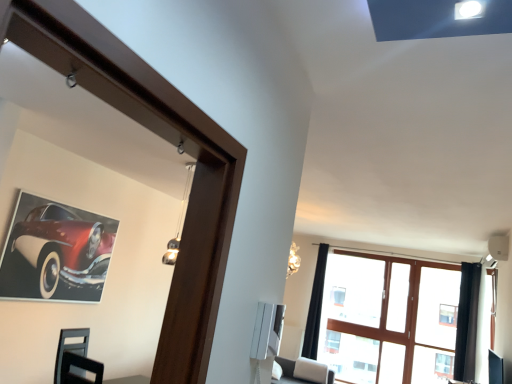
Question: From a real-world perspective, is black fabric curtain at upper right, the 2th curtain from the front, on black velvet curtain at right, which ranks as the 2th curtain in left-to-right order?

Choices:
 (A) no
 (B) yes

Answer: (A)

Question: Would you say black fabric curtain at upper right, marked as the second curtain in a right-to-left arrangement, is a long distance from black velvet curtain at right, which appears as the 1th curtain when viewed from the right?

Choices:
 (A) yes
 (B) no

Answer: (A)

Question: Does black fabric curtain at upper right, the 2th curtain from the front, have a smaller size compared to black velvet curtain at right, which is the first curtain from front to back?

Choices:
 (A) no
 (B) yes

Answer: (A)

Question: Does black fabric curtain at upper right, which ranks as the first curtain in left-to-right order, have a lesser width compared to black velvet curtain at right, which appears as the 1th curtain when viewed from the right?

Choices:
 (A) yes
 (B) no

Answer: (A)

Question: From the image's perspective, does black fabric curtain at upper right, which ranks as the first curtain in left-to-right order, appear higher than black velvet curtain at right, which is the first curtain from front to back?

Choices:
 (A) yes
 (B) no

Answer: (B)

Question: Is point (318, 312) closer or farther from the camera than point (467, 352)?

Choices:
 (A) closer
 (B) farther

Answer: (B)

Question: From the image's perspective, is black fabric curtain at upper right, marked as the 1th curtain in a back-to-front arrangement, above or below black velvet curtain at right, which appears as the 2th curtain when viewed from the back?

Choices:
 (A) above
 (B) below

Answer: (B)

Question: From a real-world perspective, relative to black velvet curtain at right, which is the first curtain from front to back, is black fabric curtain at upper right, which ranks as the first curtain in left-to-right order, vertically above or below?

Choices:
 (A) below
 (B) above

Answer: (A)

Question: Do you think black fabric curtain at upper right, marked as the second curtain in a right-to-left arrangement, is within black velvet curtain at right, which appears as the 1th curtain when viewed from the right, or outside of it?

Choices:
 (A) outside
 (B) inside

Answer: (A)

Question: From the image's perspective, is shiny red car at upper left positioned above or below black velvet curtain at right, which is the first curtain from front to back?

Choices:
 (A) above
 (B) below

Answer: (A)

Question: Based on their positions, is shiny red car at upper left located to the left or right of black velvet curtain at right, which is the first curtain from front to back?

Choices:
 (A) left
 (B) right

Answer: (A)

Question: From a real-world perspective, is shiny red car at upper left physically located above or below black velvet curtain at right, which appears as the 2th curtain when viewed from the back?

Choices:
 (A) below
 (B) above

Answer: (A)

Question: Is point (25, 263) positioned closer to the camera than point (464, 360)?

Choices:
 (A) farther
 (B) closer

Answer: (B)

Question: From their relative heights in the image, would you say black velvet curtain at right, which appears as the 2th curtain when viewed from the back, is taller or shorter than black fabric curtain at upper right, marked as the 1th curtain in a back-to-front arrangement?

Choices:
 (A) short
 (B) tall

Answer: (A)

Question: Is black velvet curtain at right, which is the first curtain from front to back, wider or thinner than black fabric curtain at upper right, marked as the 1th curtain in a back-to-front arrangement?

Choices:
 (A) wide
 (B) thin

Answer: (A)